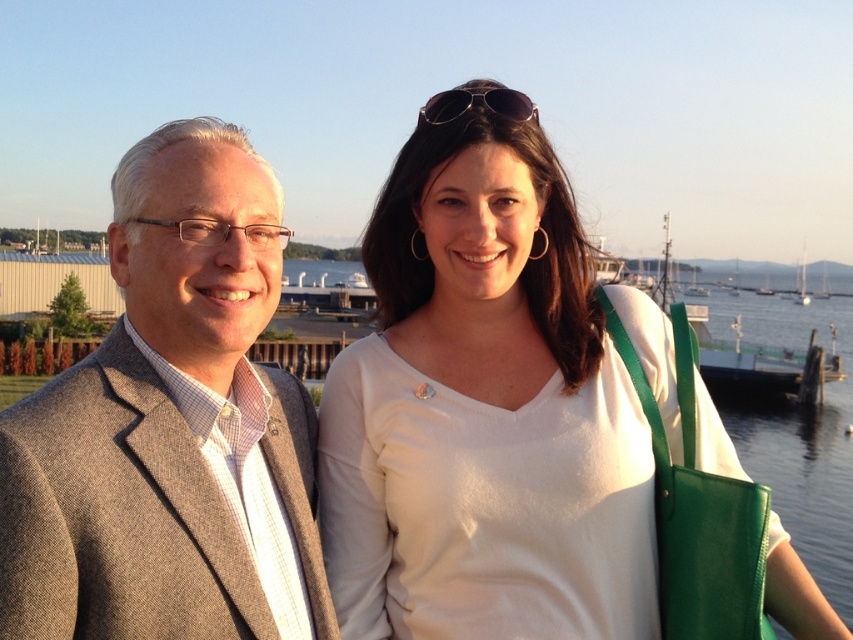
In the scene shown: You are a photographer setting up a tripod to capture the two people in the scene. The minimum distance your camera can focus clearly is 1.5 meters. Based on the positions of the white matte shirt at upper right and gray wool suit at left, will your camera be able to focus on both subjects simultaneously?

The white matte shirt at upper right and gray wool suit at left are 1.42 meters apart from each other, which is less than the camera minimum focusing distance of 1.5 meters. Therefore, the camera may not be able to focus on both subjects clearly at the same time.

You are a photographer setting up for a group photo. You have two subjects in front of you, the white matte shirt at upper right and the gray wool suit at left. Based on their sizes, which subject should you position closer to the camera to ensure both appear equally sized in the final photo?

The gray wool suit at left should be positioned closer to the camera because it is smaller in size compared to the white matte shirt at upper right. This adjustment will help balance their apparent sizes in the photo.

You are a photographer trying to capture a photo of both the white matte shirt at upper right and the gray wool suit at left. Which one should you focus on first if you want to ensure both are in clear focus?

The white matte shirt at upper right is positioned under the gray wool suit at left. Since they are at different depths, focusing on the gray wool suit at left first would ensure both are in focus as it is closer to the camera.